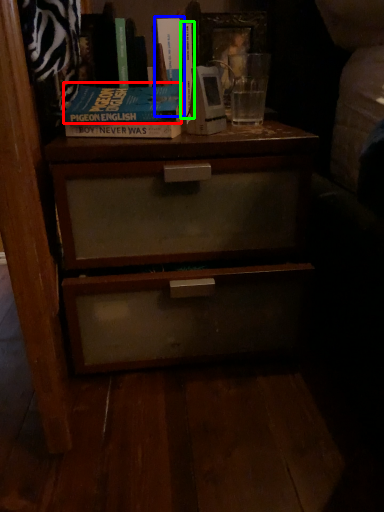
Question: Which object is the closest to the paperback book (highlighted by a red box)? Choose among these: book (highlighted by a blue box) or book (highlighted by a green box).

Choices:
 (A) book
 (B) book

Answer: (B)